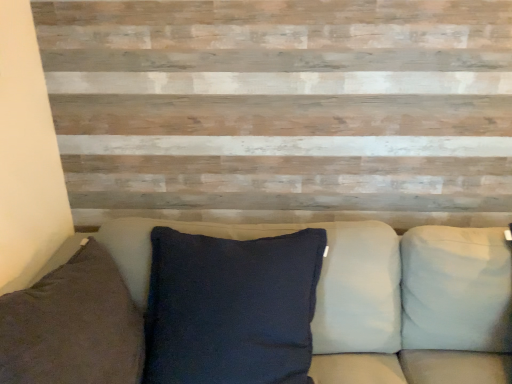
Question: Is white fabric pillow at right, marked as the second pillow in a left-to-right arrangement, inside dark blue fabric pillow at left, which ranks as the 2th pillow in right-to-left order?

Choices:
 (A) no
 (B) yes

Answer: (A)

Question: Is dark blue fabric pillow at left, the first pillow from the left, turned away from white fabric pillow at right, the 1th pillow positioned from the right?

Choices:
 (A) no
 (B) yes

Answer: (A)

Question: Does dark blue fabric pillow at left, which ranks as the 2th pillow in right-to-left order, have a greater height compared to white fabric pillow at right, the 1th pillow positioned from the right?

Choices:
 (A) no
 (B) yes

Answer: (A)

Question: From a real-world perspective, is dark blue fabric pillow at left, which ranks as the 2th pillow in right-to-left order, on white fabric pillow at right, the 1th pillow positioned from the right?

Choices:
 (A) yes
 (B) no

Answer: (A)

Question: Is dark blue fabric pillow at left, the first pillow from the left, far from white fabric pillow at right, the 1th pillow positioned from the right?

Choices:
 (A) no
 (B) yes

Answer: (B)

Question: From a real-world perspective, is white fabric pillow at right, the 1th pillow positioned from the right, above or below dark blue fabric pillow at left, the first pillow from the left?

Choices:
 (A) below
 (B) above

Answer: (A)

Question: Based on their sizes in the image, would you say white fabric pillow at right, the 1th pillow positioned from the right, is bigger or smaller than dark blue fabric pillow at left, which ranks as the 2th pillow in right-to-left order?

Choices:
 (A) small
 (B) big

Answer: (A)

Question: Is point (492, 236) closer or farther from the camera than point (7, 349)?

Choices:
 (A) closer
 (B) farther

Answer: (B)

Question: From the image's perspective, is white fabric pillow at right, marked as the second pillow in a left-to-right arrangement, located above or below dark blue fabric pillow at left, which ranks as the 2th pillow in right-to-left order?

Choices:
 (A) below
 (B) above

Answer: (B)

Question: From the image's perspective, relative to white fabric pillow at right, the 1th pillow positioned from the right, is dark fabric cushion at center above or below?

Choices:
 (A) below
 (B) above

Answer: (B)

Question: From a real-world perspective, relative to white fabric pillow at right, the 1th pillow positioned from the right, is dark fabric cushion at center vertically above or below?

Choices:
 (A) below
 (B) above

Answer: (A)

Question: Would you say dark fabric cushion at center is inside or outside white fabric pillow at right, the 1th pillow positioned from the right?

Choices:
 (A) outside
 (B) inside

Answer: (A)

Question: Relative to white fabric pillow at right, the 1th pillow positioned from the right, is dark fabric cushion at center in front or behind?

Choices:
 (A) behind
 (B) front

Answer: (B)

Question: In terms of width, does dark blue fabric pillow at left, which ranks as the 2th pillow in right-to-left order, look wider or thinner when compared to white fabric pillow at right, marked as the second pillow in a left-to-right arrangement?

Choices:
 (A) wide
 (B) thin

Answer: (A)

Question: Considering their positions, is dark blue fabric pillow at left, the first pillow from the left, located in front of or behind white fabric pillow at right, the 1th pillow positioned from the right?

Choices:
 (A) behind
 (B) front

Answer: (B)